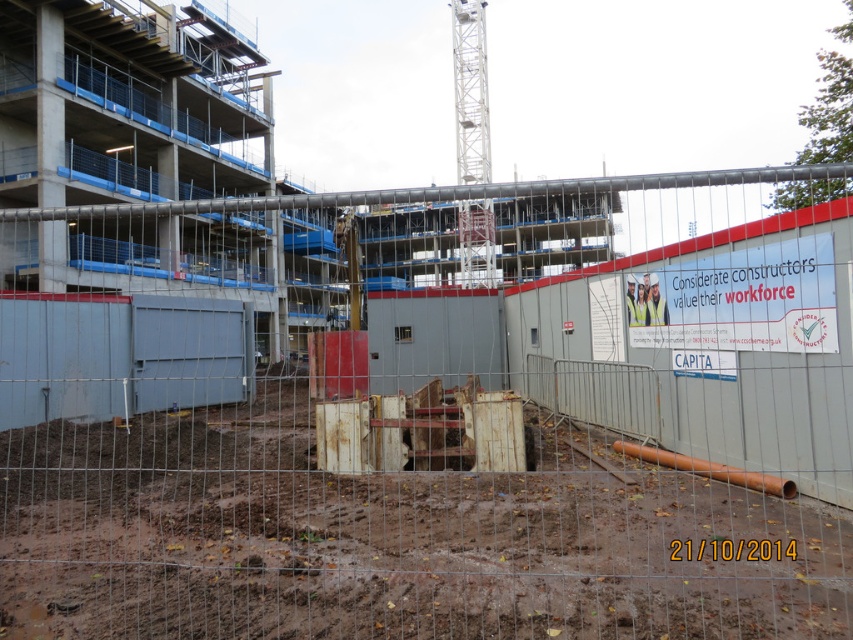
Question: Which of the following is the farthest from the observer?

Choices:
 (A) (231, 435)
 (B) (671, 550)

Answer: (A)

Question: Can you confirm if brown muddy dirt at center is smaller than white paper at center?

Choices:
 (A) no
 (B) yes

Answer: (A)

Question: From the image, what is the correct spatial relationship of brown muddy dirt at center in relation to white paper at center?

Choices:
 (A) above
 (B) below

Answer: (A)

Question: Is brown muddy dirt at center to the right of white paper at center from the viewer's perspective?

Choices:
 (A) no
 (B) yes

Answer: (A)

Question: Which point is farther from the camera taking this photo?

Choices:
 (A) (679, 557)
 (B) (575, 609)

Answer: (A)